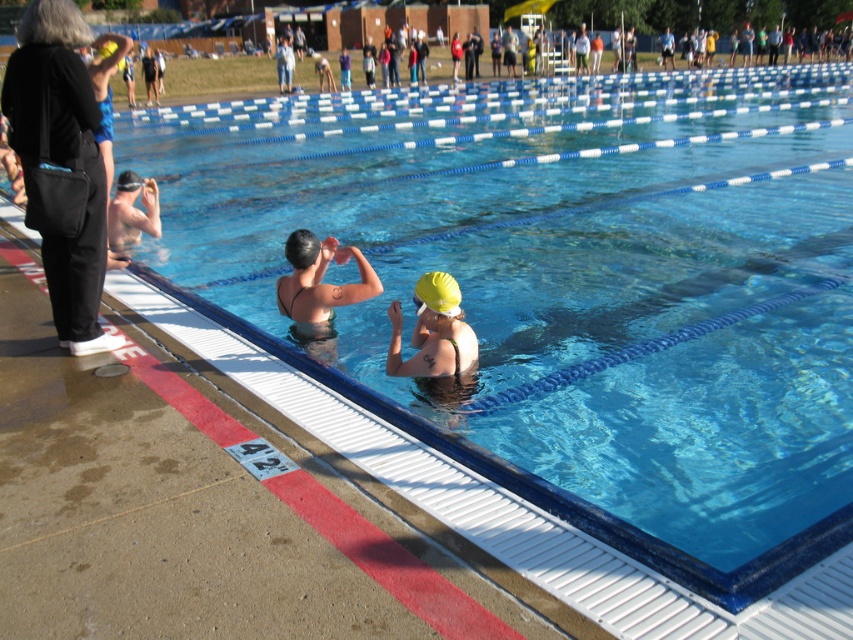
Is black fabric bag at left above yellow matte swim cap at center?

Correct, black fabric bag at left is located above yellow matte swim cap at center.

The height and width of the screenshot is (640, 853). What do you see at coordinates (61, 164) in the screenshot?
I see `black fabric bag at left` at bounding box center [61, 164].

Is point (33, 193) less distant than point (416, 280)?

Yes, point (33, 193) is in front of point (416, 280).

This screenshot has height=640, width=853. I want to click on black fabric bag at left, so click(x=61, y=164).